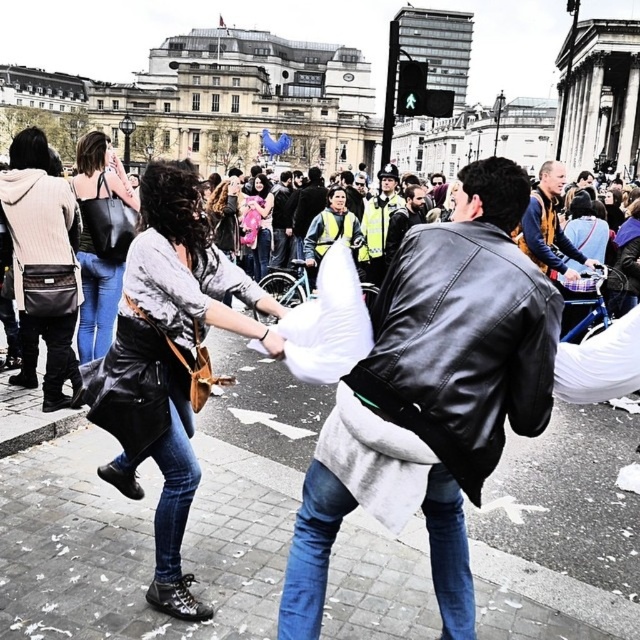
Is black leather jacket at center to the left of yellow-orange jacket at upper right from the viewer's perspective?

Correct, you'll find black leather jacket at center to the left of yellow-orange jacket at upper right.

Does black leather jacket at center have a lesser height compared to yellow-orange jacket at upper right?

No.

Who is more distant from viewer, (529, 374) or (547, 269)?

The point (547, 269) is more distant.

Find the location of a particular element. This screenshot has height=640, width=640. black leather jacket at center is located at coordinates (433, 394).

Is yellow-orange jacket at upper right thinner than reflective silver helmet at center?

No.

Can you confirm if yellow-orange jacket at upper right is taller than reflective silver helmet at center?

Correct, yellow-orange jacket at upper right is much taller as reflective silver helmet at center.

Is point (556, 220) positioned behind point (385, 179)?

No.

The height and width of the screenshot is (640, 640). What are the coordinates of `yellow-orange jacket at upper right` in the screenshot? It's located at (548, 227).

Is smooth concrete pavement at center wider than yellow-orange jacket at upper right?

Yes, smooth concrete pavement at center is wider than yellow-orange jacket at upper right.

The width and height of the screenshot is (640, 640). I want to click on smooth concrete pavement at center, so click(152, 513).